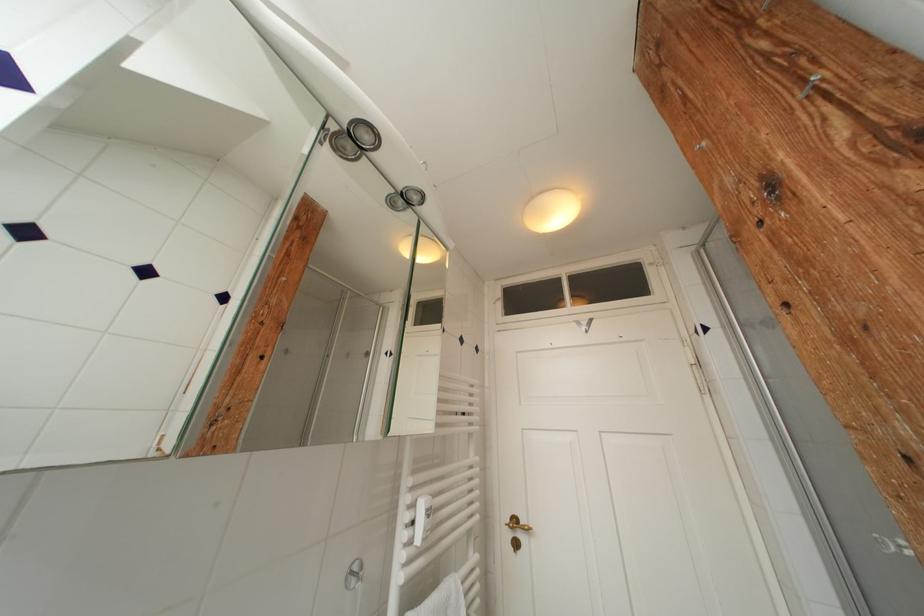
The image size is (924, 616). Describe the element at coordinates (442, 501) in the screenshot. I see `the towel radiator bar` at that location.